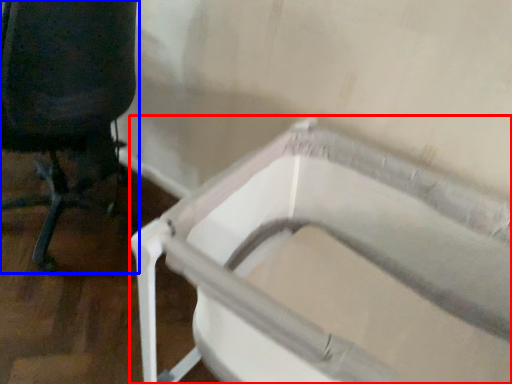
Question: Among these objects, which one is farthest to the camera, bath (highlighted by a red box) or chair (highlighted by a blue box)?

Choices:
 (A) bath
 (B) chair

Answer: (B)